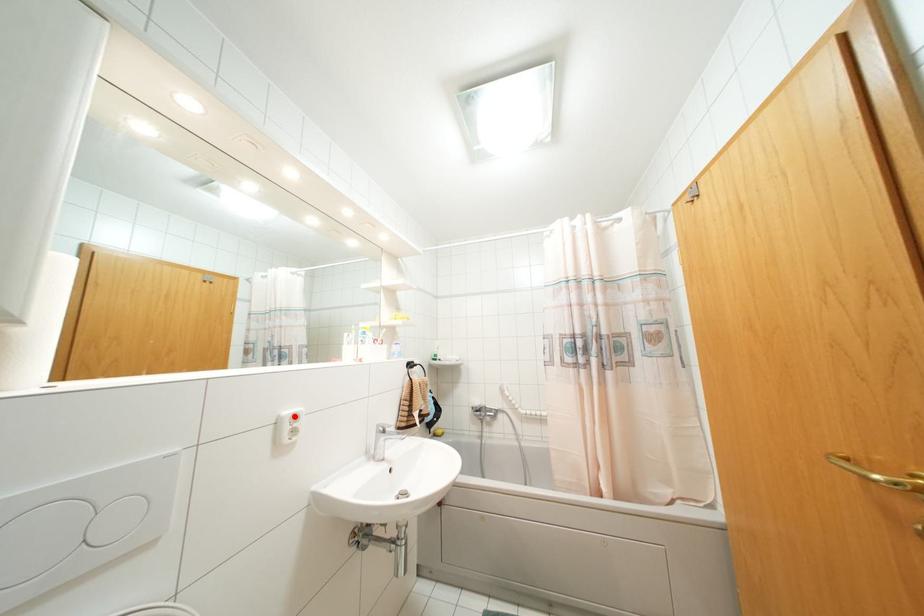
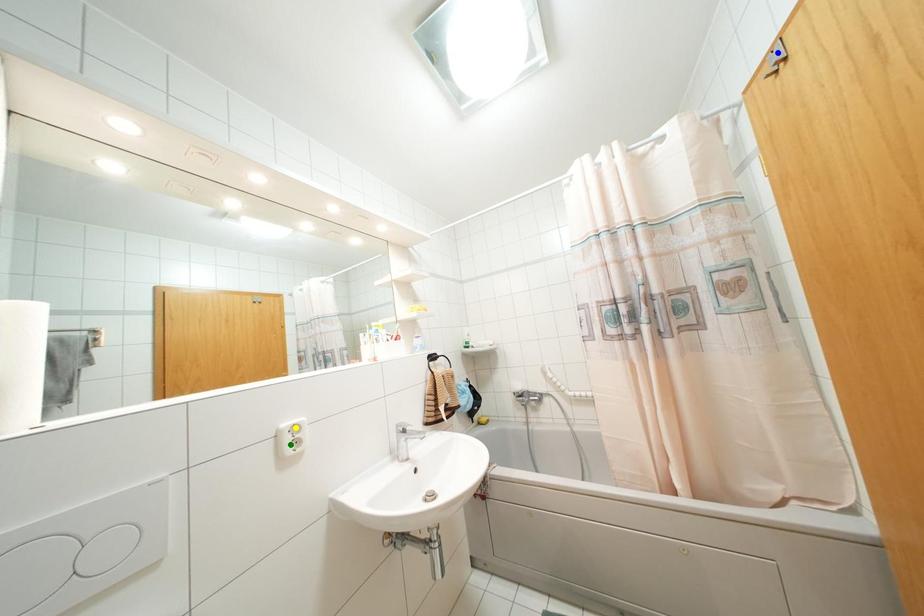
Question: I am providing you with two images of the same scene from different viewpoints. A red point is marked on the first image. You are given multiple points on the second image. In image 2, which mark is for the same physical point as the one in image 1?

Choices:
 (A) blue point
 (B) yellow point
 (C) green point

Answer: (B)